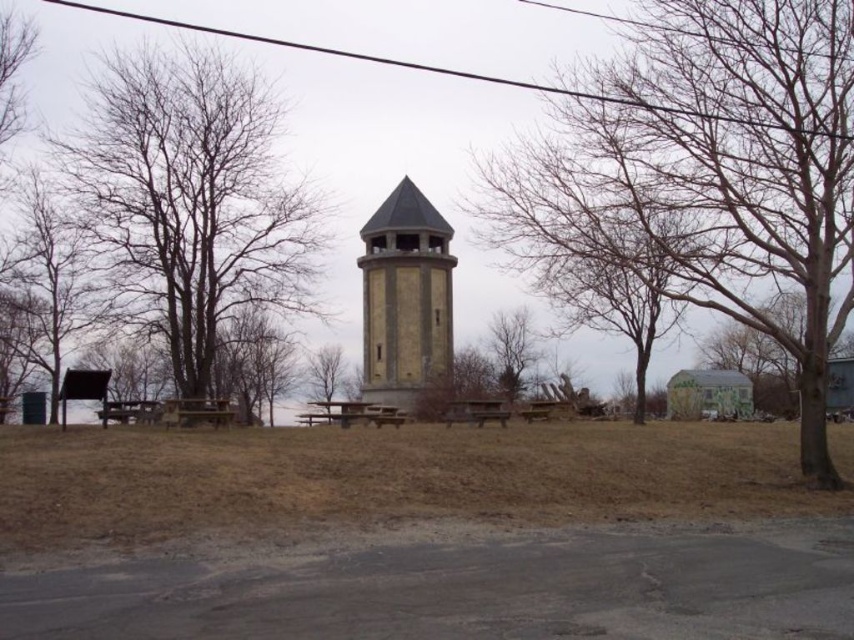
Is point (784, 138) closer to viewer compared to point (302, 228)?

Yes, it is.

At what (x,y) coordinates should I click in order to perform the action: click on bare wood tree at center. Please return your answer as a coordinate pair (x, y). The height and width of the screenshot is (640, 854). Looking at the image, I should click on (711, 176).

Locate an element on the screen. The image size is (854, 640). bare wood tree at center is located at coordinates (711, 176).

Between point (203, 337) and point (366, 422), which one is positioned in front?

Point (366, 422) is more forward.

Is bare wood tree at left further to the viewer compared to brown wooden picnic table at center?

Yes, it is.

This screenshot has height=640, width=854. I want to click on bare wood tree at left, so click(x=191, y=196).

You are a GUI agent. You are given a task and a screenshot of the screen. Output one action in this format:
    pyautogui.click(x=<x>, y=<y>)
    Task: Click on the bare wood tree at left
    The image size is (854, 640).
    Given the screenshot: What is the action you would take?
    (191, 196)

Who is taller, bare wood tree at left or bare wood picnic table at left?

Standing taller between the two is bare wood tree at left.

Is bare wood tree at left to the left of bare wood picnic table at left from the viewer's perspective?

Incorrect, bare wood tree at left is not on the left side of bare wood picnic table at left.

Which is behind, point (256, 272) or point (74, 292)?

Point (74, 292)

Identify the location of bare wood tree at left. The image size is (854, 640). (191, 196).